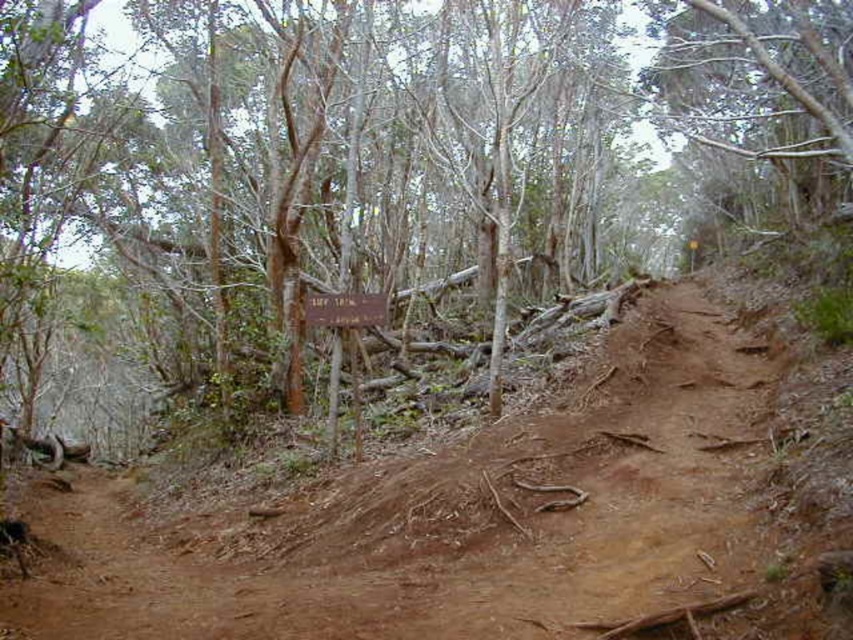
Question: Can you confirm if brown bark tree at center is wider than wooden sign at center?

Choices:
 (A) no
 (B) yes

Answer: (B)

Question: Is brown dirt track at center wider than wooden sign at center?

Choices:
 (A) yes
 (B) no

Answer: (A)

Question: Does brown bark tree at center appear on the right side of wooden sign at center?

Choices:
 (A) no
 (B) yes

Answer: (B)

Question: Which point is closer to the camera?

Choices:
 (A) brown bark tree at center
 (B) wooden sign at center
 (C) brown dirt track at center

Answer: (C)

Question: Which point is closer to the camera taking this photo?

Choices:
 (A) (325, 300)
 (B) (691, 408)
 (C) (178, 145)

Answer: (B)

Question: Which of the following is the closest to the observer?

Choices:
 (A) wooden sign at center
 (B) brown bark tree at center

Answer: (B)